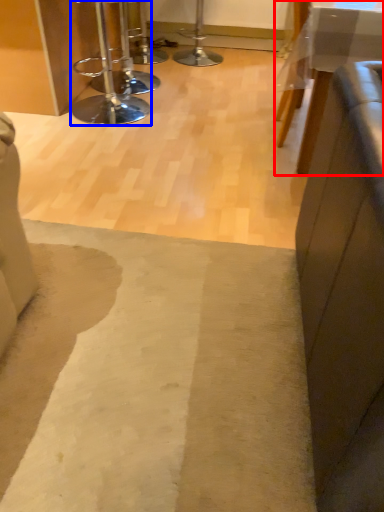
Question: Which object is closer to the camera taking this photo, table (highlighted by a red box) or stool (highlighted by a blue box)?

Choices:
 (A) table
 (B) stool

Answer: (A)